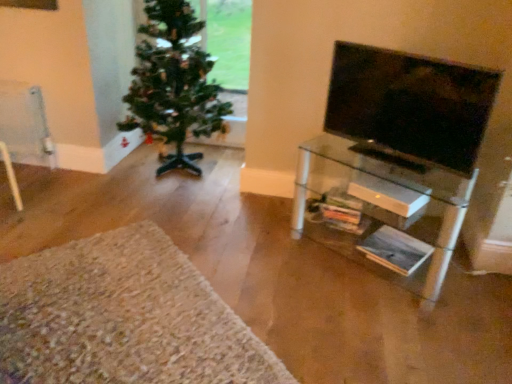
Locate an element on the screen. This screenshot has width=512, height=384. vacant space that is in between clear glass shelf at right and white shaggy rug at lower left is located at coordinates (279, 272).